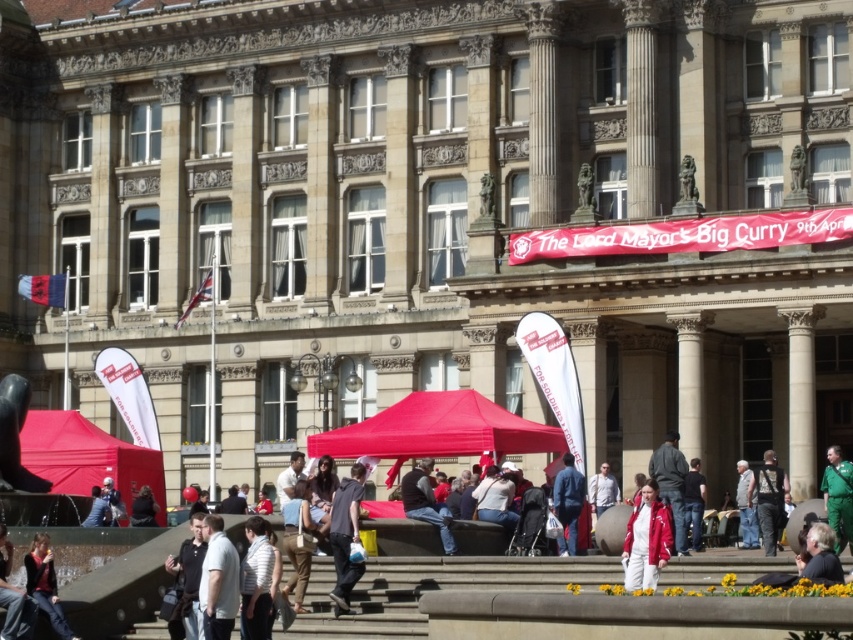
Question: Can you confirm if light gray shirt at lower left is wider than green uniform at center?

Choices:
 (A) no
 (B) yes

Answer: (A)

Question: Which is farther from the white striped shirt at center?

Choices:
 (A) red matte jacket at center
 (B) denim jacket at lower left

Answer: (B)

Question: Can you confirm if white striped shirt at center is positioned below bronze statue at upper center?

Choices:
 (A) no
 (B) yes

Answer: (B)

Question: Does red matte jacket at center appear under matte black jacket at lower left?

Choices:
 (A) yes
 (B) no

Answer: (B)

Question: Estimate the real-world distances between objects in this image. Which object is farther from the denim jacket at lower left?

Choices:
 (A) black glossy statue at lower left
 (B) white cotton shirt at lower left
 (C) bronze statue at upper center

Answer: (C)

Question: Estimate the real-world distances between objects in this image. Which object is closer to the white cotton jacket at lower right?

Choices:
 (A) dark gray fabric jacket at center
 (B) white cotton shirt at center

Answer: (A)